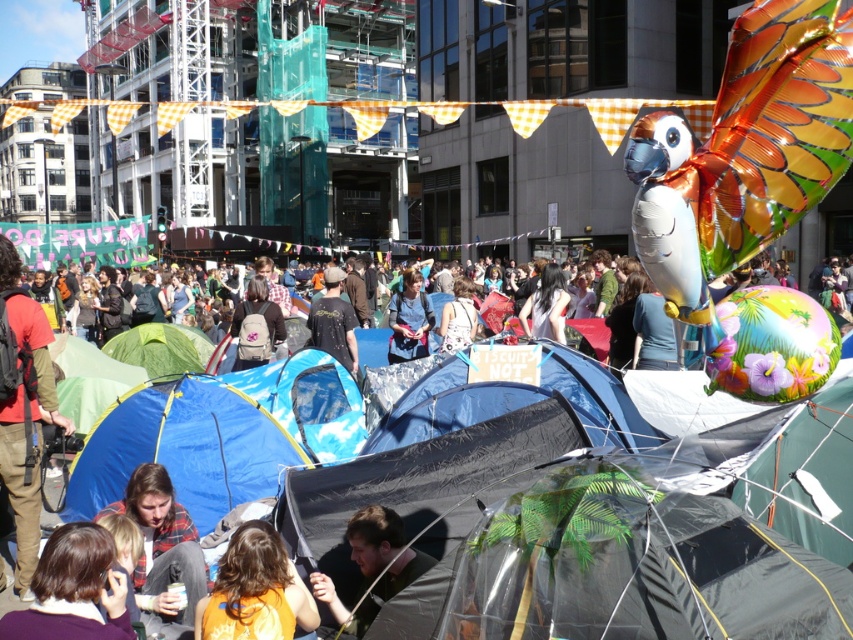
Question: Which is farther from the light brown fabric dress at center?

Choices:
 (A) orange t-shirt at center
 (B) blue tarpaulin tent at center

Answer: (A)

Question: Which point appears closest to the camera in this image?

Choices:
 (A) (180, 480)
 (B) (143, 509)
 (C) (550, 276)

Answer: (B)

Question: Which object is farther from the camera taking this photo?

Choices:
 (A) blue tarpaulin tent at center
 (B) light brown fabric dress at center
 (C) blue fabric tent at lower left
 (D) black t-shirt at center

Answer: (B)

Question: Is blue fabric tent at lower left below dark brown hair at lower left?

Choices:
 (A) no
 (B) yes

Answer: (A)

Question: Can you confirm if dark brown hair at lower left is positioned to the right of brown hair at center?

Choices:
 (A) no
 (B) yes

Answer: (A)

Question: Can you confirm if metallic silver parrot at upper right is bigger than dark brown hair at lower left?

Choices:
 (A) no
 (B) yes

Answer: (B)